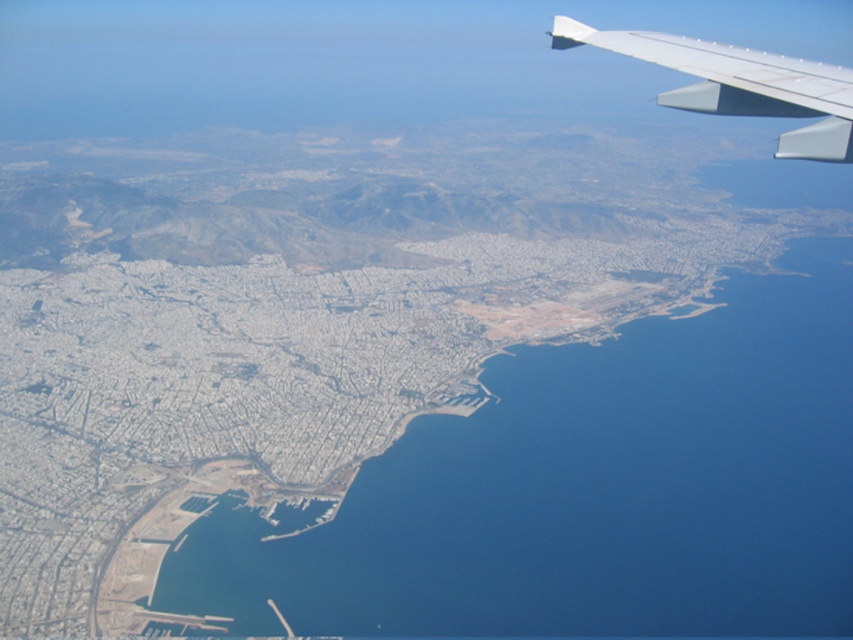
You are a pilot flying at an altitude of 1,000 meters. You notice the blue water at lower left and the white matte wing at upper right in your window view. How far apart are these two objects in the scene?

The blue water at lower left is 348.86 meters from the white matte wing at upper right.

As you look out the airplane window, you notice the white matte wing at upper right and the blue water at lower left. Which object is closer to you, the observer?

The white matte wing at upper right is behind the blue water at lower left, so the blue water at lower left is closer to you.

You are a passenger on an airplane and notice the blue water at lower left and the white matte wing at upper right through the window. Which object appears smaller in the image?

The blue water at lower left appears smaller in the image compared to the white matte wing at upper right.